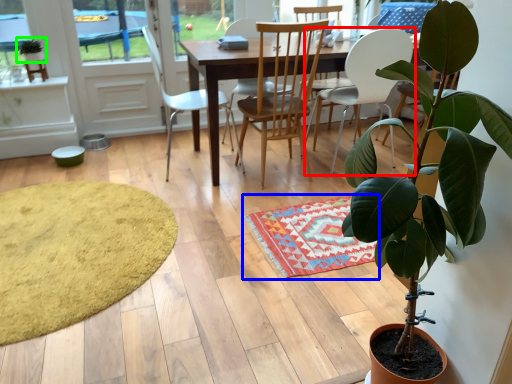
Question: Considering the real-world distances, which object is farthest from chair (highlighted by a red box)? mat (highlighted by a blue box) or houseplant (highlighted by a green box)?

Choices:
 (A) mat
 (B) houseplant

Answer: (B)